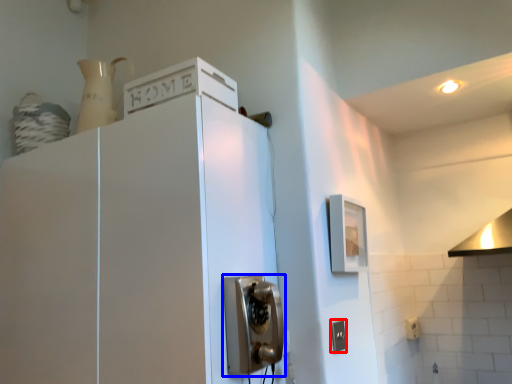
Question: Which object is closer to the camera taking this photo, electric outlet (highlighted by a red box) or door handle (highlighted by a blue box)?

Choices:
 (A) electric outlet
 (B) door handle

Answer: (B)